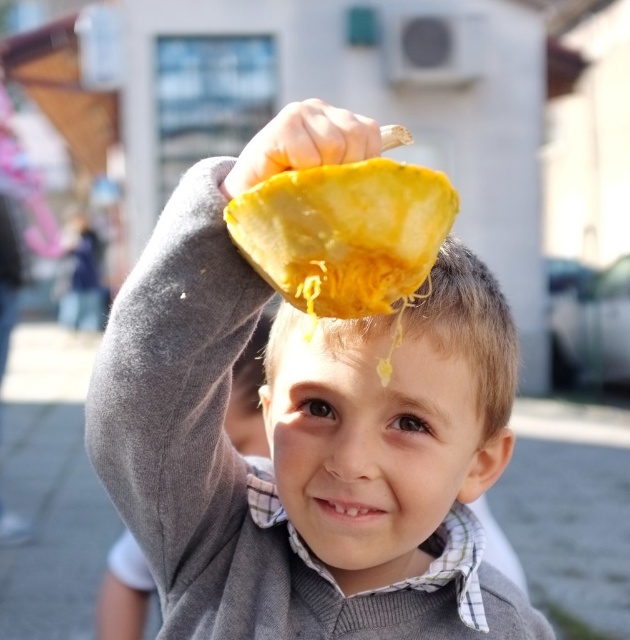
Question: From the image, what is the correct spatial relationship of yellow matte pumpkin at upper center in relation to smooth yellow fruit at upper center?

Choices:
 (A) right
 (B) left

Answer: (A)

Question: From the image, what is the correct spatial relationship of smooth yellow squash at upper center in relation to smooth yellow fruit at upper center?

Choices:
 (A) left
 (B) right

Answer: (B)

Question: Among these points, which one is nearest to the camera?

Choices:
 (A) (306, 113)
 (B) (496, 406)

Answer: (A)

Question: Which object is the closest to the yellow matte pumpkin at upper center?

Choices:
 (A) smooth yellow squash at upper center
 (B) yellow soft pumpkin at center

Answer: (B)

Question: Considering the real-world distances, which object is closest to the yellow matte pumpkin at upper center?

Choices:
 (A) smooth yellow squash at upper center
 (B) yellow soft pumpkin at center

Answer: (B)

Question: Is yellow soft pumpkin at center below yellow matte pumpkin at upper center?

Choices:
 (A) no
 (B) yes

Answer: (A)